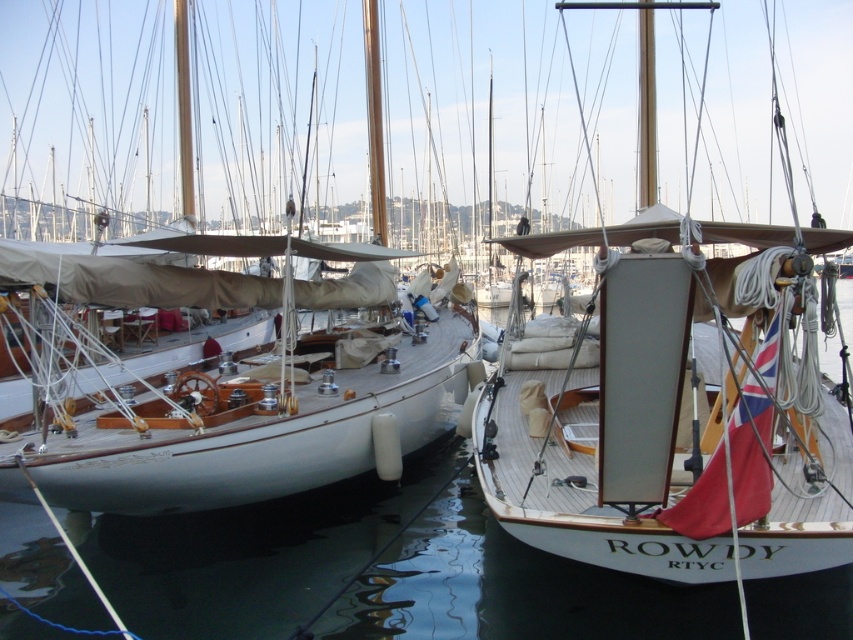
Question: Which object is closer to the camera taking this photo?

Choices:
 (A) clear water at center
 (B) wooden sailboat at center
 (C) white polished wood boat at center

Answer: (B)

Question: Which of these objects is positioned farthest from the clear water at center?

Choices:
 (A) wooden sailboat at center
 (B) white polished wood boat at center

Answer: (A)

Question: Where is wooden sailboat at center located in relation to white polished wood boat at center in the image?

Choices:
 (A) right
 (B) left

Answer: (A)

Question: Among these points, which one is nearest to the camera?

Choices:
 (A) (250, 588)
 (B) (125, 273)
 (C) (695, 518)

Answer: (C)

Question: Is wooden sailboat at center smaller than white polished wood boat at center?

Choices:
 (A) yes
 (B) no

Answer: (B)

Question: Is clear water at center smaller than white polished wood boat at center?

Choices:
 (A) yes
 (B) no

Answer: (A)